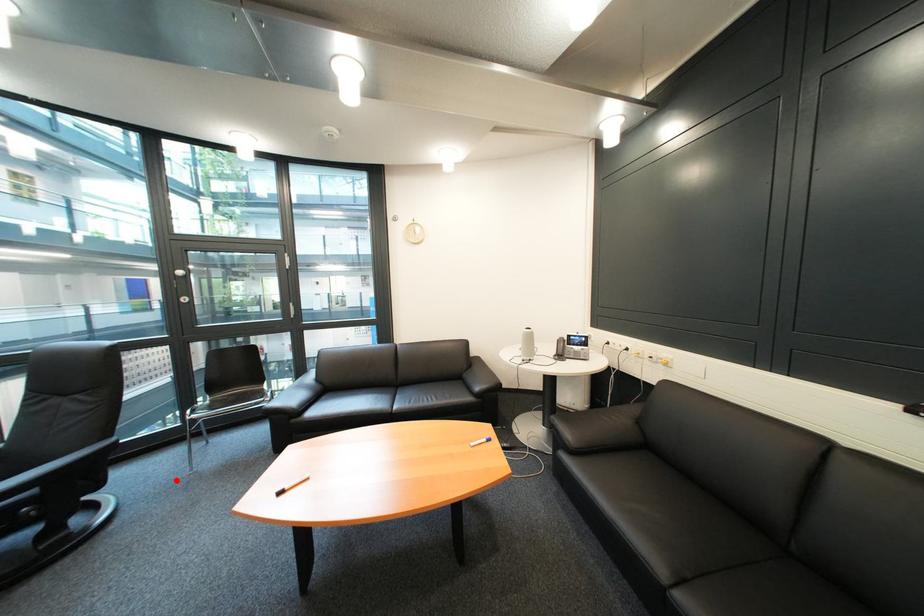
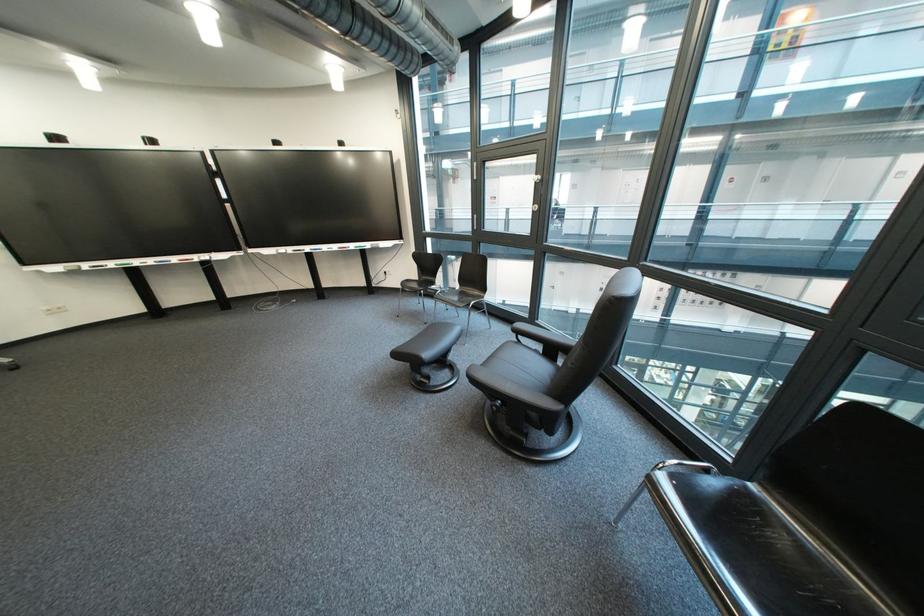
Question: I am providing you with two images of the same scene from different viewpoints. Given a red point in image1, look at the same physical point in image2. Is it:

Choices:
 (A) Closer to the viewpoint
 (B) Farther from the viewpoint

Answer: (A)